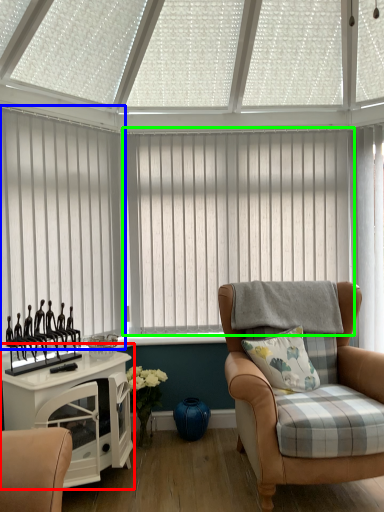
Question: Estimate the real-world distances between objects in this image. Which object is farther from table (highlighted by a red box), window blind (highlighted by a blue box) or window blind (highlighted by a green box)?

Choices:
 (A) window blind
 (B) window blind

Answer: (B)